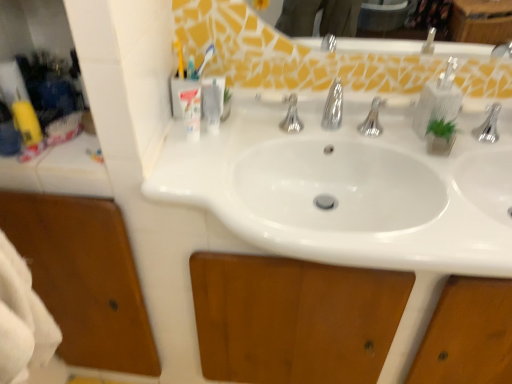
Question: Considering the relative positions of translucent plastic toothbrush holder at upper left, acting as the second toiletry starting from the right, and clear plastic soap dispenser at upper center, placed as the first toiletry when sorted from right to left, in the image provided, is translucent plastic toothbrush holder at upper left, acting as the second toiletry starting from the right, to the left of clear plastic soap dispenser at upper center, placed as the first toiletry when sorted from right to left, from the viewer's perspective?

Choices:
 (A) yes
 (B) no

Answer: (A)

Question: From the image's perspective, would you say translucent plastic toothbrush holder at upper left, acting as the second toiletry starting from the right, is shown under clear plastic soap dispenser at upper center, placed as the first toiletry when sorted from right to left?

Choices:
 (A) no
 (B) yes

Answer: (B)

Question: Does translucent plastic toothbrush holder at upper left, the 1th toiletry viewed from the left, have a larger size compared to clear plastic soap dispenser at upper center, the 2th toiletry positioned from the left?

Choices:
 (A) no
 (B) yes

Answer: (B)

Question: Does translucent plastic toothbrush holder at upper left, acting as the second toiletry starting from the right, have a smaller size compared to clear plastic soap dispenser at upper center, the 2th toiletry positioned from the left?

Choices:
 (A) yes
 (B) no

Answer: (B)

Question: Are translucent plastic toothbrush holder at upper left, acting as the second toiletry starting from the right, and clear plastic soap dispenser at upper center, the 2th toiletry positioned from the left, far apart?

Choices:
 (A) no
 (B) yes

Answer: (A)

Question: Is clear plastic soap dispenser at upper right in front of or behind translucent plastic toothbrush holder at upper left, acting as the second toiletry starting from the right, in the image?

Choices:
 (A) behind
 (B) front

Answer: (A)

Question: Looking at the image, does clear plastic soap dispenser at upper right seem bigger or smaller compared to translucent plastic toothbrush holder at upper left, acting as the second toiletry starting from the right?

Choices:
 (A) small
 (B) big

Answer: (B)

Question: Is point (418, 97) positioned closer to the camera than point (179, 91)?

Choices:
 (A) closer
 (B) farther

Answer: (B)

Question: From a real-world perspective, is clear plastic soap dispenser at upper right positioned above or below translucent plastic toothbrush holder at upper left, the 1th toiletry viewed from the left?

Choices:
 (A) above
 (B) below

Answer: (A)

Question: Do you think translucent plastic toothbrush holder at upper left, acting as the second toiletry starting from the right, is within clear plastic soap dispenser at upper center, the 2th toiletry positioned from the left, or outside of it?

Choices:
 (A) inside
 (B) outside

Answer: (B)

Question: Looking at the image, does translucent plastic toothbrush holder at upper left, the 1th toiletry viewed from the left, seem bigger or smaller compared to clear plastic soap dispenser at upper center, the 2th toiletry positioned from the left?

Choices:
 (A) small
 (B) big

Answer: (B)

Question: Considering the positions of translucent plastic toothbrush holder at upper left, the 1th toiletry viewed from the left, and clear plastic soap dispenser at upper center, placed as the first toiletry when sorted from right to left, in the image, is translucent plastic toothbrush holder at upper left, the 1th toiletry viewed from the left, wider or thinner than clear plastic soap dispenser at upper center, placed as the first toiletry when sorted from right to left,?

Choices:
 (A) wide
 (B) thin

Answer: (A)

Question: Is point (190, 127) positioned closer to the camera than point (216, 91)?

Choices:
 (A) farther
 (B) closer

Answer: (A)

Question: Based on their positions, is translucent plastic toothbrush at upper center located to the left or right of clear plastic soap dispenser at upper center, placed as the first toiletry when sorted from right to left?

Choices:
 (A) right
 (B) left

Answer: (B)

Question: Considering their positions, is translucent plastic toothbrush at upper center located in front of or behind clear plastic soap dispenser at upper center, placed as the first toiletry when sorted from right to left?

Choices:
 (A) behind
 (B) front

Answer: (A)